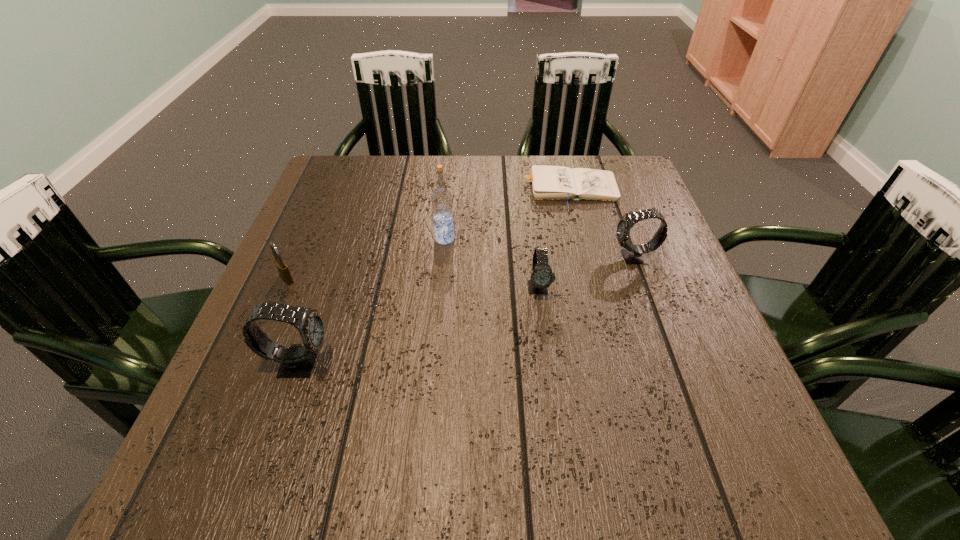
The width and height of the screenshot is (960, 540). Identify the location of free spot at the far left corner of the desktop. (315, 189).

Find the location of a particular element. vacant region at the far right corner of the desktop is located at coordinates (593, 167).

Find the location of a particular element. This screenshot has height=540, width=960. free spot at the near right corner of the desktop is located at coordinates (723, 399).

At what (x,y) coordinates should I click in order to perform the action: click on free space between the second object from left to right and the rightmost watch. Please return your answer as a coordinate pair (x, y). Image resolution: width=960 pixels, height=540 pixels. Looking at the image, I should click on (467, 310).

You are a GUI agent. You are given a task and a screenshot of the screen. Output one action in this format:
    pyautogui.click(x=<x>, y=<y>)
    Task: Click on the free space between the shortest object and the nearest object
    
    Given the screenshot: What is the action you would take?
    pyautogui.click(x=434, y=275)

Where is `vacant area that lies between the farthest watch and the padlock`? vacant area that lies between the farthest watch and the padlock is located at coordinates (461, 268).

This screenshot has width=960, height=540. In order to click on free point between the farthest object and the farthest watch in this screenshot , I will do `click(601, 222)`.

Identify the location of free spot between the leftmost object and the second farthest object. This screenshot has width=960, height=540. (366, 259).

You are a GUI agent. You are given a task and a screenshot of the screen. Output one action in this format:
    pyautogui.click(x=<x>, y=<y>)
    Task: Click on the vacant area between the second watch from left to right and the padlock
    The image size is (960, 540).
    Given the screenshot: What is the action you would take?
    pyautogui.click(x=413, y=283)

Identify the location of free point between the second object from left to right and the second shortest watch. This screenshot has height=540, width=960. (467, 310).